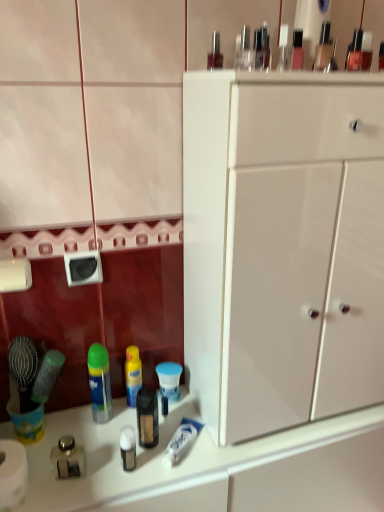
Question: From the image's perspective, is white matte toilet paper at lower left over green plastic mouthwash at center?

Choices:
 (A) no
 (B) yes

Answer: (A)

Question: Is white matte toilet paper at lower left positioned before green plastic mouthwash at center?

Choices:
 (A) yes
 (B) no

Answer: (A)

Question: From the image's perspective, is white matte toilet paper at lower left beneath green plastic mouthwash at center?

Choices:
 (A) yes
 (B) no

Answer: (A)

Question: Is white matte toilet paper at lower left aimed at green plastic mouthwash at center?

Choices:
 (A) no
 (B) yes

Answer: (A)

Question: Does white matte toilet paper at lower left have a greater width compared to green plastic mouthwash at center?

Choices:
 (A) yes
 (B) no

Answer: (A)

Question: Considering the relative positions of white matte toilet paper at lower left and green plastic mouthwash at center in the image provided, is white matte toilet paper at lower left to the right of green plastic mouthwash at center from the viewer's perspective?

Choices:
 (A) yes
 (B) no

Answer: (B)

Question: Considering the relative sizes of white glossy cabinet at center and clear glass jar at lower left, which appears as the first toiletry when ordered from the bottom, in the image provided, is white glossy cabinet at center smaller than clear glass jar at lower left, which appears as the first toiletry when ordered from the bottom,?

Choices:
 (A) no
 (B) yes

Answer: (A)

Question: Is the depth of white glossy cabinet at center greater than that of clear glass jar at lower left, the 2th toiletry viewed from the top?

Choices:
 (A) no
 (B) yes

Answer: (A)

Question: Is white glossy cabinet at center completely or partially outside of clear glass jar at lower left, which is the 1th toiletry in left-to-right order?

Choices:
 (A) no
 (B) yes

Answer: (B)

Question: Considering the relative sizes of white glossy cabinet at center and clear glass jar at lower left, the 2th toiletry viewed from the top, in the image provided, is white glossy cabinet at center wider than clear glass jar at lower left, the 2th toiletry viewed from the top,?

Choices:
 (A) no
 (B) yes

Answer: (B)

Question: Can you confirm if white glossy cabinet at center is shorter than clear glass jar at lower left, the 2th toiletry from the back?

Choices:
 (A) no
 (B) yes

Answer: (A)

Question: From a real-world perspective, is white glossy cabinet at center over clear glass jar at lower left, which appears as the first toiletry when ordered from the bottom?

Choices:
 (A) no
 (B) yes

Answer: (B)

Question: Considering the relative positions of white glossy cabinet at center and white glossy counter top at lower left in the image provided, is white glossy cabinet at center to the right of white glossy counter top at lower left from the viewer's perspective?

Choices:
 (A) no
 (B) yes

Answer: (B)